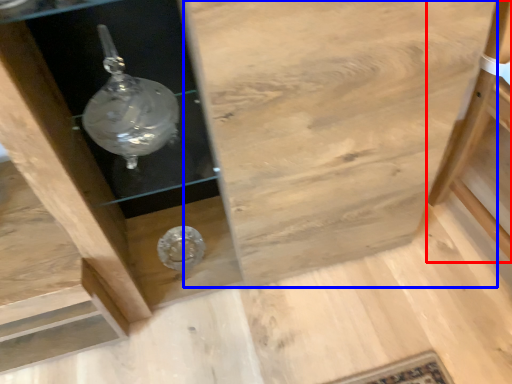
Question: Which object appears closest to the camera in this image, furniture (highlighted by a red box) or cabinetry (highlighted by a blue box)?

Choices:
 (A) furniture
 (B) cabinetry

Answer: (B)